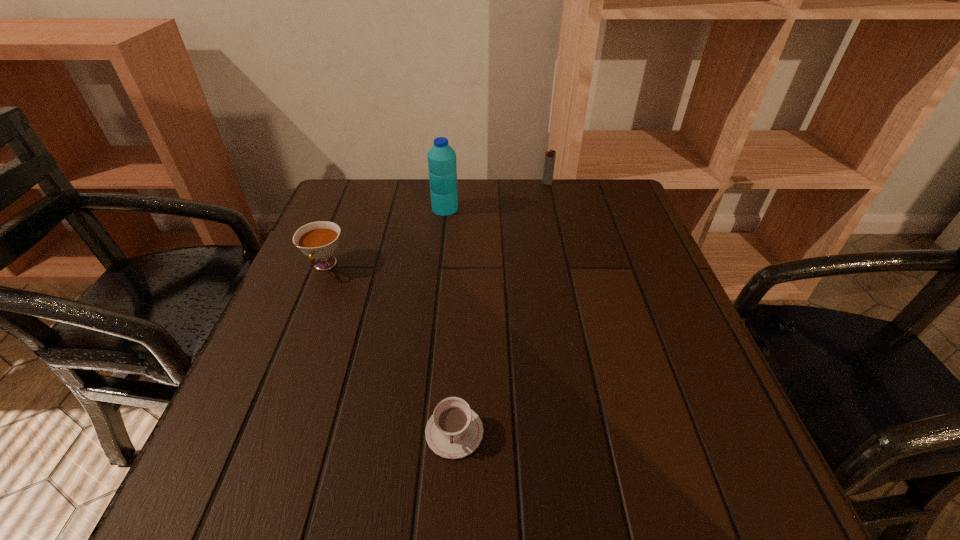
Locate an element on the screen. The image size is (960, 540). free space between the right teacup and the igniter is located at coordinates (501, 308).

The image size is (960, 540). What are the coordinates of `free space between the second farthest object and the farthest object` in the screenshot? It's located at (496, 196).

Point out which object is positioned as the third nearest to the right teacup. Please provide its 2D coordinates. Your answer should be formatted as a tuple, i.e. [(x, y)], where the tuple contains the x and y coordinates of a point satisfying the conditions above.

[(549, 162)]

Identify the location of the closest object relative to the second farthest object. The width and height of the screenshot is (960, 540). (319, 240).